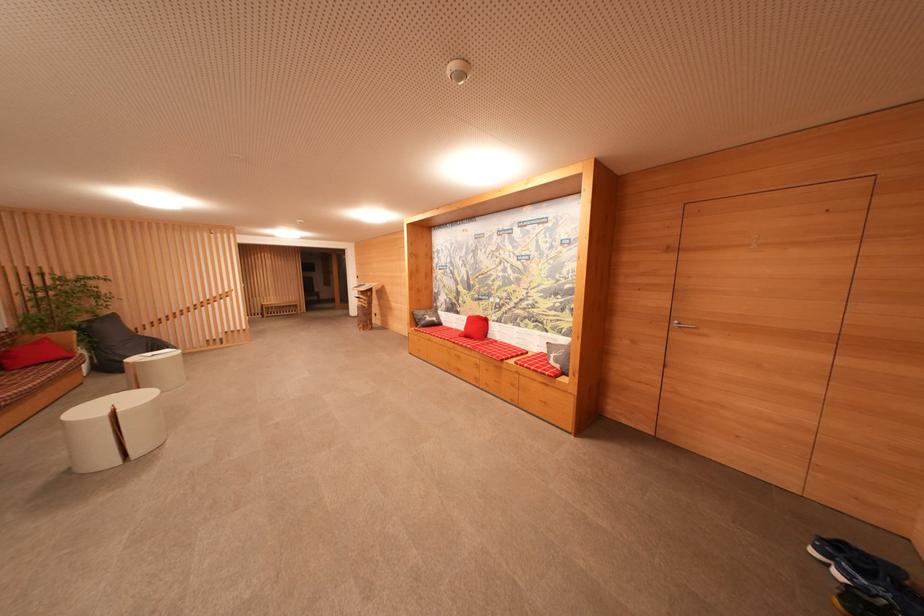
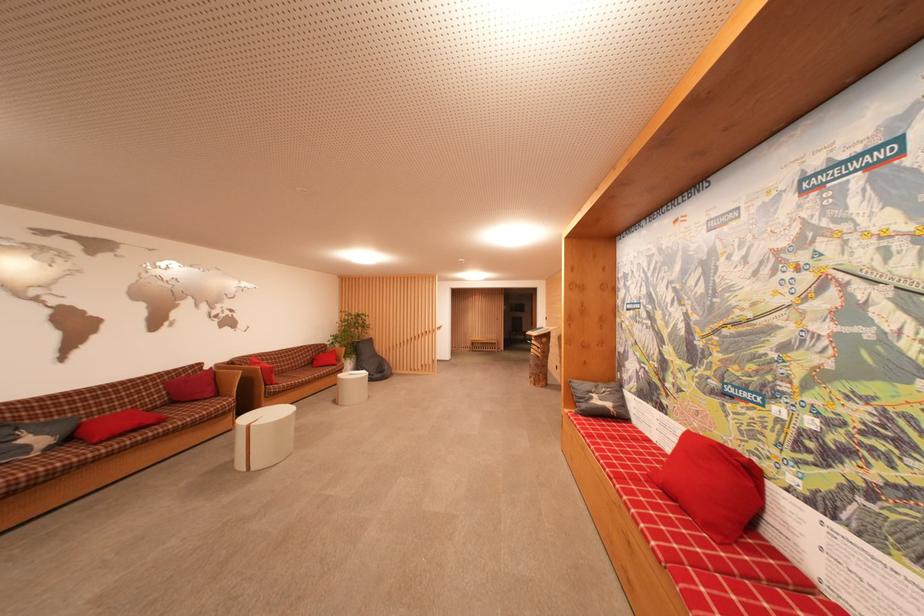
Where in the second image is the point corresponding to point 50,342 from the first image?

(338, 354)